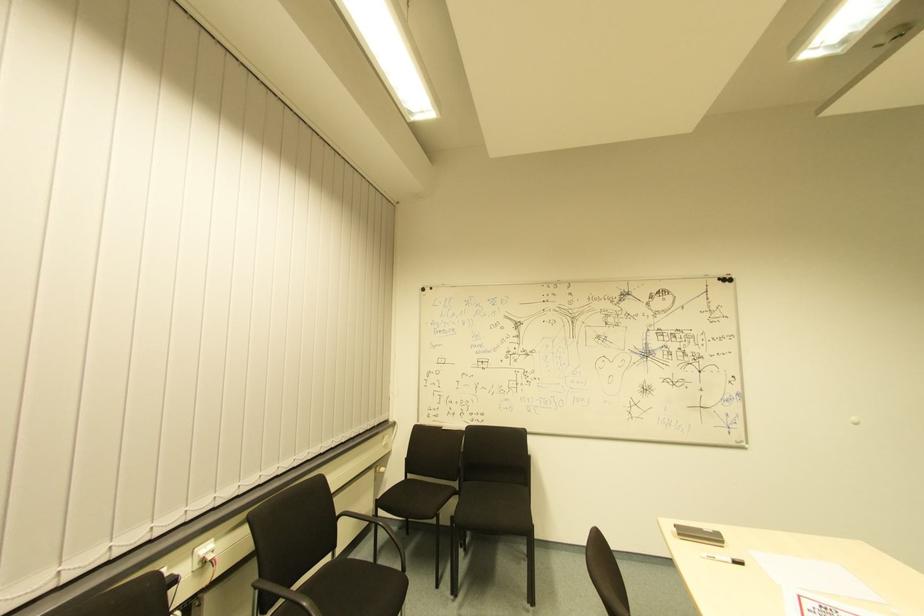
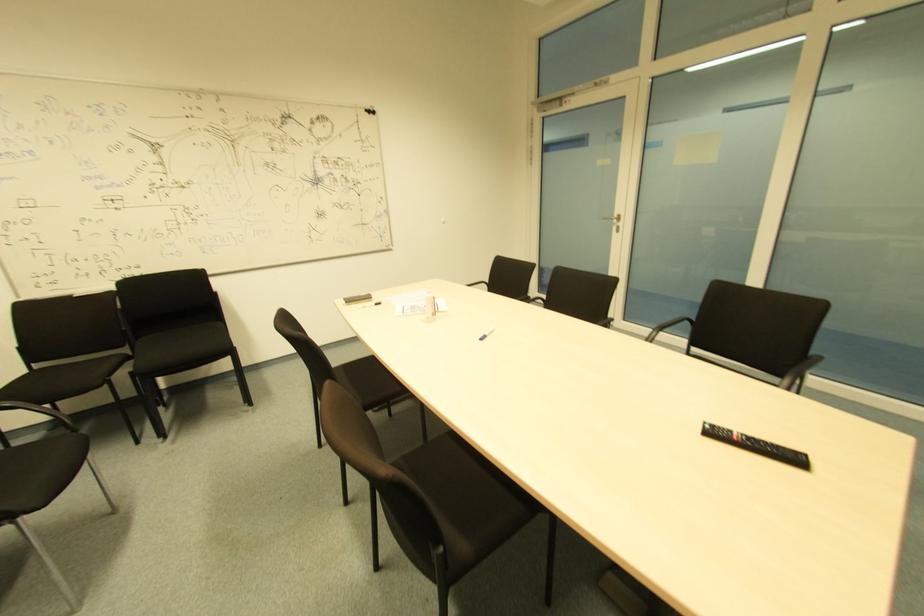
Where in the second image is the point corresponding to point 408,479 from the first image?

(34, 370)